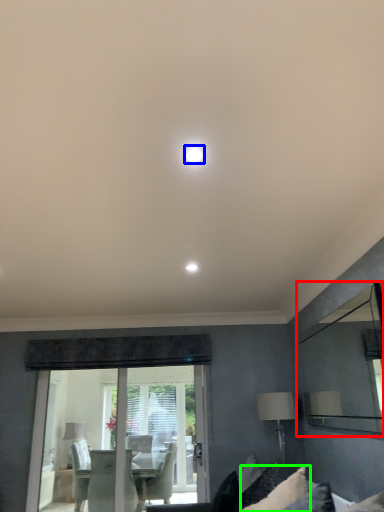
Question: Which object is positioned farthest from mirror (highlighted by a red box)? Select from lighting (highlighted by a blue box) and pillow (highlighted by a green box).

Choices:
 (A) lighting
 (B) pillow

Answer: (A)